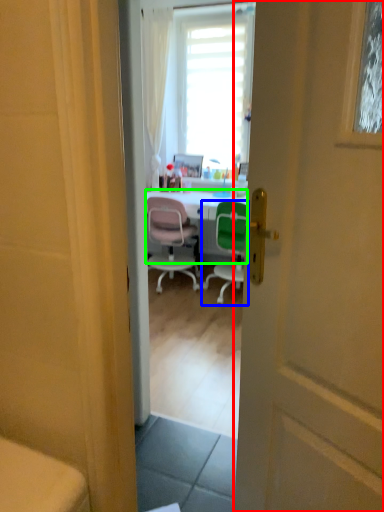
Question: Based on their relative distances, which object is farther from door (highlighted by a red box)? Choose from chair (highlighted by a blue box) and desk (highlighted by a green box).

Choices:
 (A) chair
 (B) desk

Answer: (B)